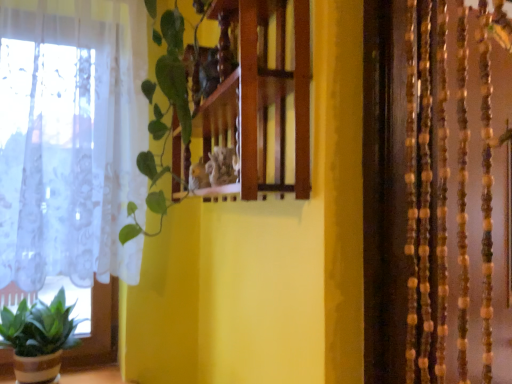
Question: From their relative heights in the image, would you say green matte plant at lower left is taller or shorter than wooden shelf at center?

Choices:
 (A) tall
 (B) short

Answer: (B)

Question: Visually, is green matte plant at lower left positioned to the left or to the right of wooden shelf at center?

Choices:
 (A) right
 (B) left

Answer: (B)

Question: Estimate the real-world distances between objects in this image. Which object is closer to the green matte plant at lower left?

Choices:
 (A) green leafy plant at center
 (B) wooden shelf at center

Answer: (A)

Question: Estimate the real-world distances between objects in this image. Which object is farther from the green leafy plant at center?

Choices:
 (A) wooden shelf at center
 (B) green matte plant at lower left

Answer: (B)